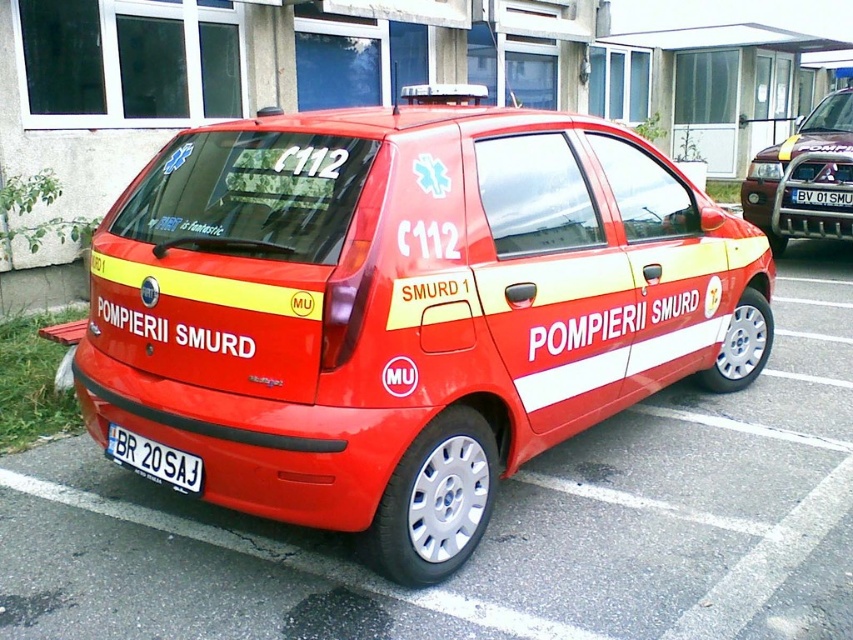
You are a driver approaching the parking lot and see the image. You need to park your car behind the matte red car at center without blocking the white plastic license plate at center. Is this possible?

The matte red car at center is to the left of the white plastic license plate at center, so parking behind the matte red car at center would not block the white plastic license plate at center. It is possible.

You are a delivery driver who needs to park your truck in the parking lot. You see the matte red car at center and the white plastic license plate at center. Which object is bigger in size?

The matte red car at center is larger in size compared to the white plastic license plate at center.

You are a photographer trying to capture the white plastic license plate at center clearly. The metallic silver suv at upper right is blocking your view. Can you estimate whether the suv is tall enough to block the license plate completely?

The metallic silver suv at upper right is much taller than the white plastic license plate at center, so the suv will block the license plate completely.